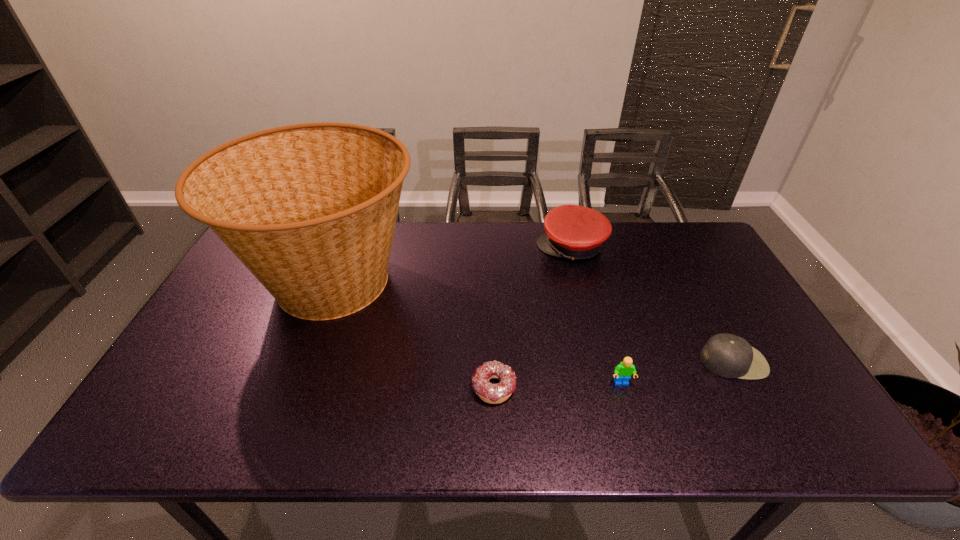
Locate an element on the screen. The image size is (960, 540). basket is located at coordinates (310, 209).

At what (x,y) coordinates should I click in order to perform the action: click on the tallest object. Please return your answer as a coordinate pair (x, y). Looking at the image, I should click on (310, 209).

This screenshot has width=960, height=540. In order to click on the fourth shortest object in this screenshot , I will do `click(574, 232)`.

I want to click on the left cap, so click(574, 232).

Locate an element on the screen. The height and width of the screenshot is (540, 960). the third tallest object is located at coordinates (623, 371).

At what (x,y) coordinates should I click in order to perform the action: click on the right cap. Please return your answer as a coordinate pair (x, y). Looking at the image, I should click on (729, 356).

Find the location of a particular element. This screenshot has height=540, width=960. the rightmost object is located at coordinates (729, 356).

In order to click on doughnut in this screenshot , I will do `click(490, 393)`.

Identify the location of the shortest object. Image resolution: width=960 pixels, height=540 pixels. (490, 393).

Where is `vacant space located 0.220m on the front of the basket`? vacant space located 0.220m on the front of the basket is located at coordinates (276, 433).